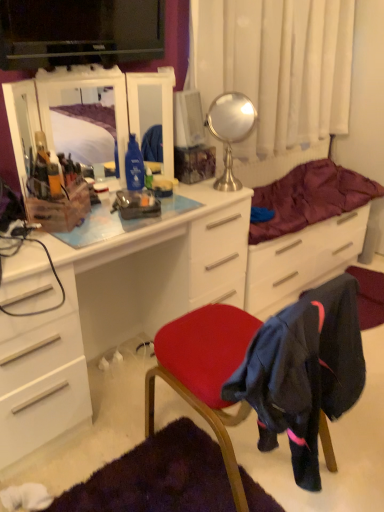
Question: Is white glossy chest of drawers at center bigger than polished silver mirror at upper center, the second mirror viewed from the left?

Choices:
 (A) yes
 (B) no

Answer: (A)

Question: Is white glossy chest of drawers at center further to camera compared to polished silver mirror at upper center, placed as the 1th mirror when sorted from right to left?

Choices:
 (A) no
 (B) yes

Answer: (A)

Question: From the image's perspective, would you say white glossy chest of drawers at center is positioned over polished silver mirror at upper center, placed as the 1th mirror when sorted from right to left?

Choices:
 (A) yes
 (B) no

Answer: (B)

Question: Considering the relative sizes of white glossy chest of drawers at center and polished silver mirror at upper center, placed as the 1th mirror when sorted from right to left, in the image provided, is white glossy chest of drawers at center wider than polished silver mirror at upper center, placed as the 1th mirror when sorted from right to left,?

Choices:
 (A) no
 (B) yes

Answer: (B)

Question: Would you say polished silver mirror at upper center, the second mirror viewed from the left, is part of white glossy chest of drawers at center's contents?

Choices:
 (A) yes
 (B) no

Answer: (B)

Question: Based on their sizes in the image, would you say velvet red chair at center is bigger or smaller than maroon quilted blanket at center?

Choices:
 (A) big
 (B) small

Answer: (A)

Question: In the image, is velvet red chair at center positioned in front of or behind maroon quilted blanket at center?

Choices:
 (A) front
 (B) behind

Answer: (A)

Question: From a real-world perspective, is velvet red chair at center positioned above or below maroon quilted blanket at center?

Choices:
 (A) below
 (B) above

Answer: (A)

Question: In terms of width, does velvet red chair at center look wider or thinner when compared to maroon quilted blanket at center?

Choices:
 (A) wide
 (B) thin

Answer: (A)

Question: In terms of size, does white sheer curtain at upper center appear bigger or smaller than velvet red chair at center?

Choices:
 (A) small
 (B) big

Answer: (A)

Question: Is white sheer curtain at upper center inside or outside of velvet red chair at center?

Choices:
 (A) outside
 (B) inside

Answer: (A)

Question: From a real-world perspective, is white sheer curtain at upper center physically located above or below velvet red chair at center?

Choices:
 (A) above
 (B) below

Answer: (A)

Question: Is point (276, 8) positioned closer to the camera than point (269, 334)?

Choices:
 (A) farther
 (B) closer

Answer: (A)

Question: Would you say matte plastic mirror at upper left, which is the 1th mirror in left-to-right order, is inside or outside maroon quilted blanket at center?

Choices:
 (A) outside
 (B) inside

Answer: (A)

Question: Is matte plastic mirror at upper left, which is the 1th mirror in left-to-right order, to the left or to the right of maroon quilted blanket at center in the image?

Choices:
 (A) left
 (B) right

Answer: (A)